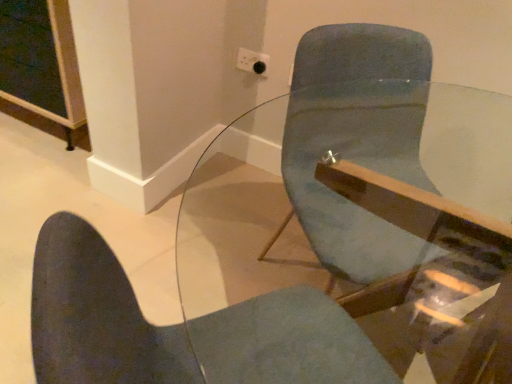
Question: From the image's perspective, is transparent glass table at center beneath matte blue chair at center?

Choices:
 (A) no
 (B) yes

Answer: (B)

Question: Would you say transparent glass table at center contains matte blue chair at center?

Choices:
 (A) yes
 (B) no

Answer: (B)

Question: Does transparent glass table at center have a greater height compared to matte blue chair at center?

Choices:
 (A) no
 (B) yes

Answer: (B)

Question: Is transparent glass table at center bigger than matte blue chair at center?

Choices:
 (A) yes
 (B) no

Answer: (A)

Question: Considering the relative sizes of transparent glass table at center and matte blue chair at center in the image provided, is transparent glass table at center thinner than matte blue chair at center?

Choices:
 (A) yes
 (B) no

Answer: (A)

Question: Is transparent glass table at center spatially inside matte blue chair at center, or outside of it?

Choices:
 (A) outside
 (B) inside

Answer: (A)

Question: From the image's perspective, is transparent glass table at center above or below matte blue chair at center?

Choices:
 (A) below
 (B) above

Answer: (A)

Question: From a real-world perspective, is transparent glass table at center above or below matte blue chair at center?

Choices:
 (A) below
 (B) above

Answer: (B)

Question: In the image, is transparent glass table at center on the left side or the right side of matte blue chair at center?

Choices:
 (A) right
 (B) left

Answer: (A)

Question: Considering the positions of white plastic socket at upper center and matte blue chair at center in the image, is white plastic socket at upper center wider or thinner than matte blue chair at center?

Choices:
 (A) wide
 (B) thin

Answer: (B)

Question: From the image's perspective, is white plastic socket at upper center located above or below matte blue chair at center?

Choices:
 (A) above
 (B) below

Answer: (A)

Question: In terms of height, does white plastic socket at upper center look taller or shorter compared to matte blue chair at center?

Choices:
 (A) short
 (B) tall

Answer: (B)

Question: Relative to matte blue chair at center, is white plastic socket at upper center in front or behind?

Choices:
 (A) behind
 (B) front

Answer: (A)

Question: Do you think transparent glass table at center is within white plastic socket at upper center, or outside of it?

Choices:
 (A) inside
 (B) outside

Answer: (B)

Question: From the image's perspective, is transparent glass table at center above or below white plastic socket at upper center?

Choices:
 (A) below
 (B) above

Answer: (A)